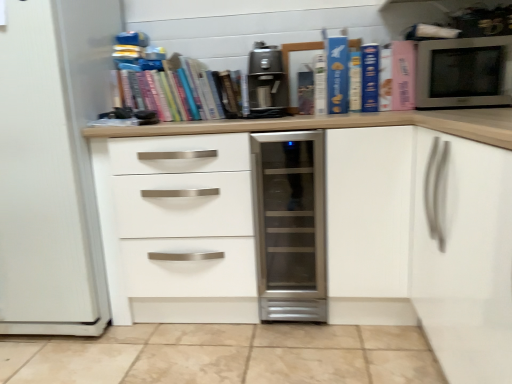
Question: From a real-world perspective, is white matte drawer at center positioned over hardcover book at center, arranged as the 6th paperback book when viewed from the right, based on gravity?

Choices:
 (A) yes
 (B) no

Answer: (B)

Question: From the image's perspective, would you say white matte drawer at center is shown under hardcover book at center, arranged as the 6th paperback book when viewed from the right?

Choices:
 (A) yes
 (B) no

Answer: (A)

Question: Can you confirm if white matte drawer at center is taller than hardcover book at center, arranged as the 6th paperback book when viewed from the right?

Choices:
 (A) yes
 (B) no

Answer: (A)

Question: Is hardcover book at center, which appears as the second paperback book when viewed from the left, located within white matte drawer at center?

Choices:
 (A) yes
 (B) no

Answer: (B)

Question: Is white matte drawer at center oriented away from hardcover book at center, arranged as the 6th paperback book when viewed from the right?

Choices:
 (A) yes
 (B) no

Answer: (B)

Question: Is white matte drawer at center smaller than hardcover book at center, which appears as the second paperback book when viewed from the left?

Choices:
 (A) yes
 (B) no

Answer: (B)

Question: From the image's perspective, is blue cardboard book at upper right, which is the 5th paperback book in right-to-left order, on top of hardcover books at upper center?

Choices:
 (A) no
 (B) yes

Answer: (B)

Question: Can you confirm if blue cardboard book at upper right, which is the 5th paperback book in right-to-left order, is smaller than hardcover books at upper center?

Choices:
 (A) no
 (B) yes

Answer: (B)

Question: Is blue cardboard book at upper right, which is the third paperback book from left to right, at the left side of hardcover books at upper center?

Choices:
 (A) yes
 (B) no

Answer: (B)

Question: Can hardcover books at upper center be found inside blue cardboard book at upper right, which is the 5th paperback book in right-to-left order?

Choices:
 (A) yes
 (B) no

Answer: (B)

Question: Does blue cardboard book at upper right, which is the 5th paperback book in right-to-left order, touch hardcover books at upper center?

Choices:
 (A) no
 (B) yes

Answer: (A)

Question: Is the depth of blue cardboard book at upper right, which is the 5th paperback book in right-to-left order, greater than that of hardcover books at upper center?

Choices:
 (A) no
 (B) yes

Answer: (A)

Question: Is blue matte book at upper center, marked as the fourth paperback book in a left-to-right arrangement, directly adjacent to matte paper at center, arranged as the seventh paperback book when viewed from the right?

Choices:
 (A) yes
 (B) no

Answer: (B)